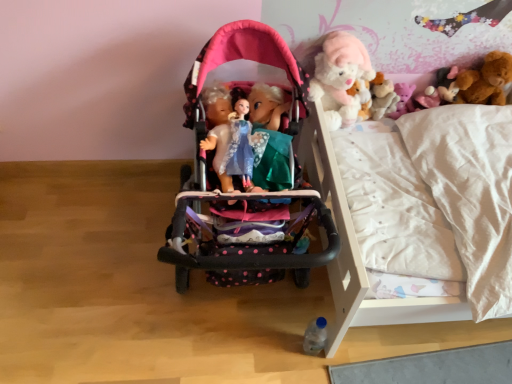
Find the location of a particular element. This screenshot has height=384, width=512. free space below white wooden bunk bed at center (from a real-world perspective) is located at coordinates (240, 311).